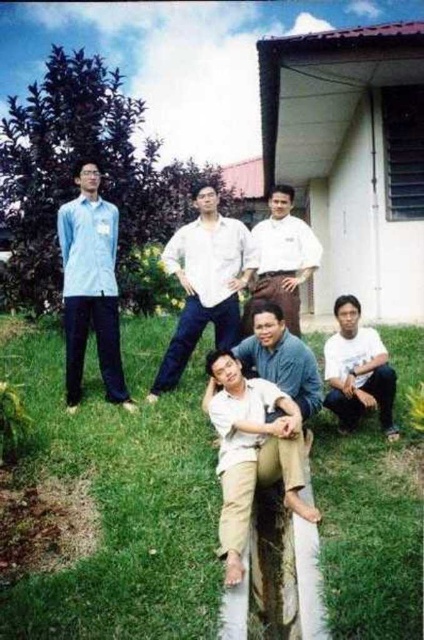
Consider the image. Does white cotton shirt at center have a greater height compared to white cotton shirt at lower right?

Correct, white cotton shirt at center is much taller as white cotton shirt at lower right.

Is white cotton shirt at center further to the viewer compared to white cotton shirt at lower right?

Yes, it is.

This screenshot has width=424, height=640. I want to click on white cotton shirt at center, so click(x=203, y=284).

This screenshot has height=640, width=424. I want to click on white cotton shirt at center, so click(203, 284).

Which is more to the left, green grass at lower center or light brown cotton shirt at lower center?

green grass at lower center

Which is below, green grass at lower center or light brown cotton shirt at lower center?

Positioned lower is green grass at lower center.

Describe the element at coordinates (122, 508) in the screenshot. The image size is (424, 640). I see `green grass at lower center` at that location.

Find the location of a particular element. The width and height of the screenshot is (424, 640). green grass at lower center is located at coordinates (122, 508).

Can you confirm if green grass at lower center is smaller than white cotton shirt at lower right?

Yes.

Based on the photo, does green grass at lower center appear under white cotton shirt at lower right?

Yes, green grass at lower center is below white cotton shirt at lower right.

Is point (406, 483) less distant than point (368, 364)?

That is True.

This screenshot has width=424, height=640. Identify the location of green grass at lower center. (122, 508).